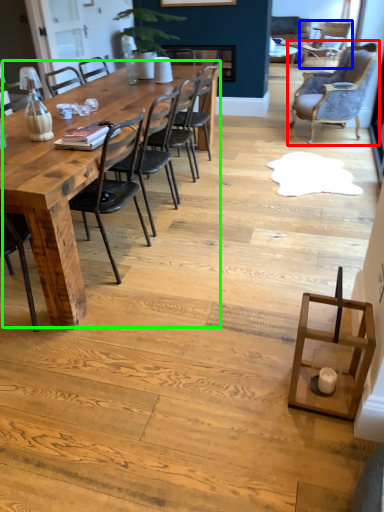
Question: Estimate the real-world distances between objects in this image. Which object is closer to chair (highlighted by a red box), chair (highlighted by a blue box) or kitchen & dining room table (highlighted by a green box)?

Choices:
 (A) chair
 (B) kitchen & dining room table

Answer: (A)